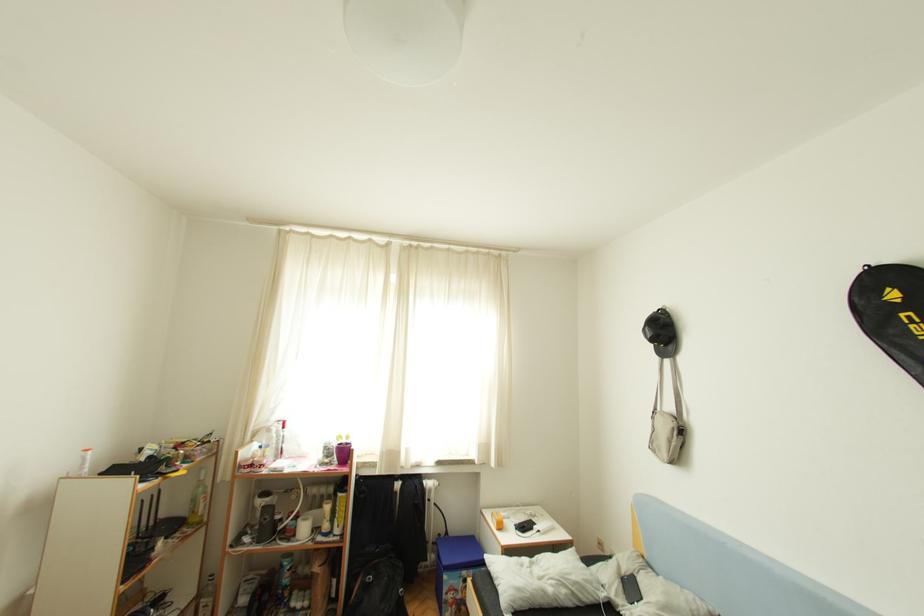
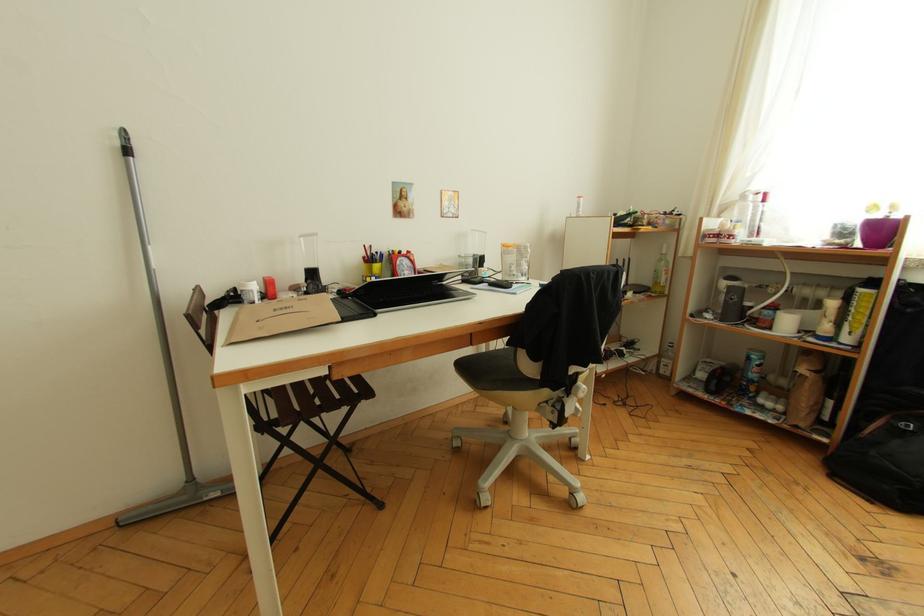
How did the camera likely rotate?

The camera's rotation is toward left-down.